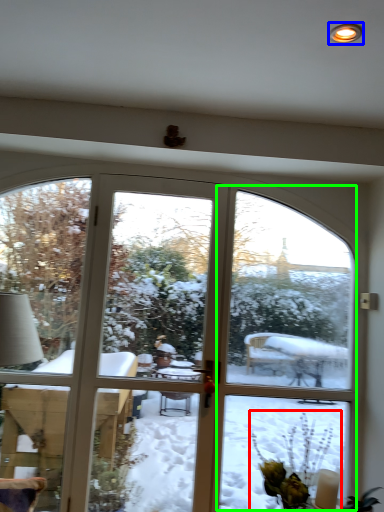
Question: Which object is the closest to the floral arrangement (highlighted by a red box)? Choose among these: light (highlighted by a blue box) or screen door (highlighted by a green box).

Choices:
 (A) light
 (B) screen door

Answer: (B)